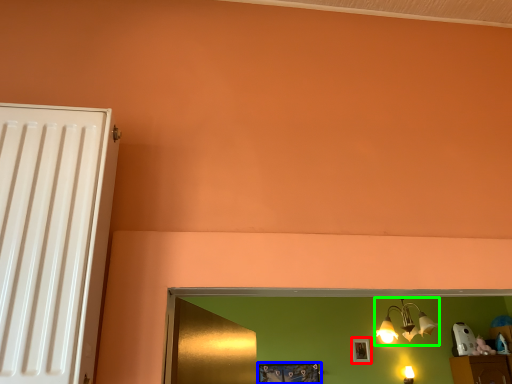
Question: Estimate the real-world distances between objects in this image. Which object is closer to picture frame (highlighted by a red box), picture frame (highlighted by a blue box) or lamp (highlighted by a green box)?

Choices:
 (A) picture frame
 (B) lamp

Answer: (B)